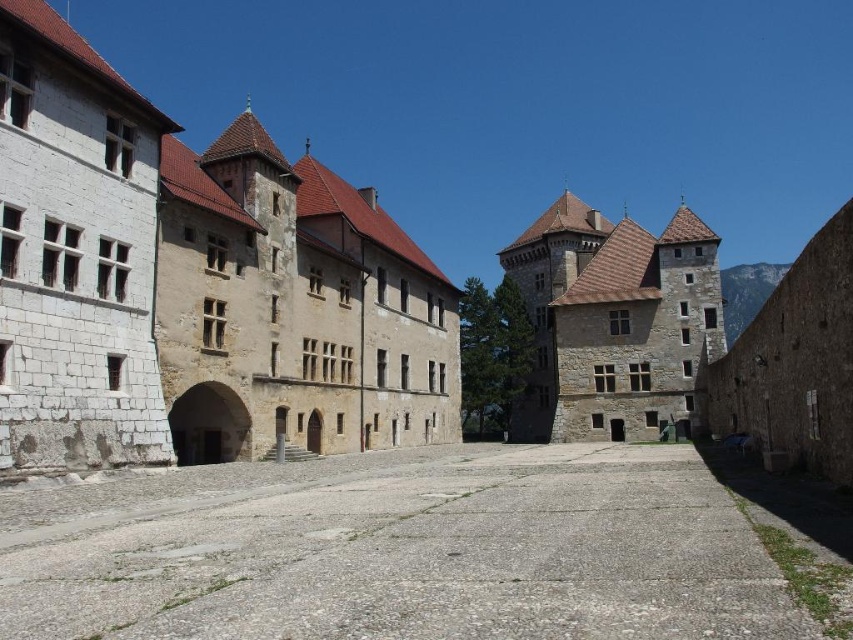
You are a tour guide leading a group through the courtyard. You want to move from the white stone building at center to the gray concrete alley at center. Is there enough space between them for a 2.5 meter wide tour bus to pass through?

The distance between the white stone building at center and the gray concrete alley at center is 24.61 meters. Since the tour bus is only 2.5 meters wide, there is more than enough space for it to pass through comfortably.

You are a visitor in the courtyard and want to walk to the gray concrete alley at center. Which direction should you go relative to the white stone building at center?

To reach the gray concrete alley at center, you should go behind the white stone building at center since it is located behind it.

You are a visitor standing in the courtyard and want to take a photo of the white stone building at center and the gray concrete alley at center. Which object is taller so that it can be captured fully in the frame without cropping?

The white stone building at center has a greater height compared to the gray concrete alley at center, so it is taller and should be positioned to be captured fully in the frame without cropping.